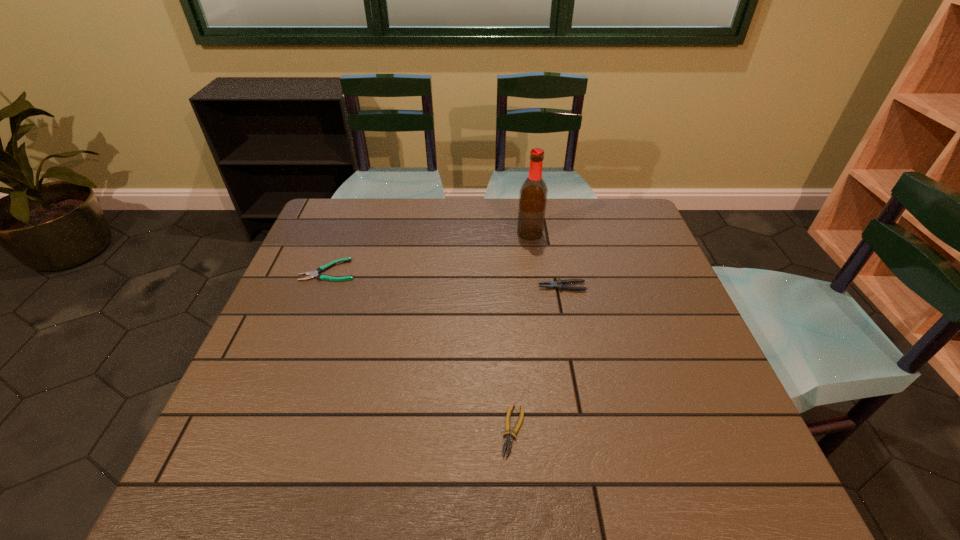
At what (x,y) coordinates should I click in order to perform the action: click on empty space between the nearest object and the leftmost object. Please return your answer as a coordinate pair (x, y). Looking at the image, I should click on (421, 350).

The image size is (960, 540). Identify the location of unoccupied area between the second pliers from left to right and the leftmost object. (421, 350).

In order to click on object that is the second closest to the rightmost pliers in this screenshot , I will do `click(508, 441)`.

You are a GUI agent. You are given a task and a screenshot of the screen. Output one action in this format:
    pyautogui.click(x=<x>, y=<y>)
    Task: Click on the third closest object to the beer bottle
    The height and width of the screenshot is (540, 960).
    Given the screenshot: What is the action you would take?
    pyautogui.click(x=508, y=441)

Where is `pliers identified as the closest to the farthest object`? pliers identified as the closest to the farthest object is located at coordinates (559, 284).

The image size is (960, 540). I want to click on pliers that is the second closest one to the third object from right to left, so click(312, 274).